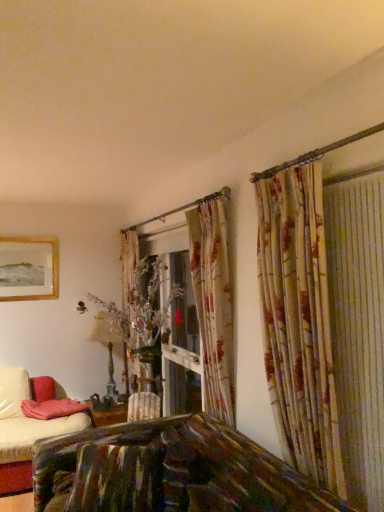
Question: Does antique brass table lamp at center contain pink fabric pillow at lower left?

Choices:
 (A) no
 (B) yes

Answer: (A)

Question: Can you confirm if antique brass table lamp at center is wider than pink fabric pillow at lower left?

Choices:
 (A) yes
 (B) no

Answer: (B)

Question: Considering the relative positions of antique brass table lamp at center and pink fabric pillow at lower left in the image provided, is antique brass table lamp at center in front of pink fabric pillow at lower left?

Choices:
 (A) no
 (B) yes

Answer: (A)

Question: Is antique brass table lamp at center taller than pink fabric pillow at lower left?

Choices:
 (A) no
 (B) yes

Answer: (B)

Question: Is antique brass table lamp at center bigger than pink fabric pillow at lower left?

Choices:
 (A) no
 (B) yes

Answer: (B)

Question: Does antique brass table lamp at center have a smaller size compared to pink fabric pillow at lower left?

Choices:
 (A) yes
 (B) no

Answer: (B)

Question: Does pink fabric pillow at lower left lie behind wooden framed picture at upper left?

Choices:
 (A) yes
 (B) no

Answer: (B)

Question: Is pink fabric pillow at lower left to the left of wooden framed picture at upper left from the viewer's perspective?

Choices:
 (A) no
 (B) yes

Answer: (A)

Question: From the image's perspective, is pink fabric pillow at lower left on wooden framed picture at upper left?

Choices:
 (A) yes
 (B) no

Answer: (B)

Question: Is pink fabric pillow at lower left outside wooden framed picture at upper left?

Choices:
 (A) no
 (B) yes

Answer: (B)

Question: Can you confirm if pink fabric pillow at lower left is smaller than wooden framed picture at upper left?

Choices:
 (A) no
 (B) yes

Answer: (A)

Question: Can you confirm if pink fabric pillow at lower left is shorter than wooden framed picture at upper left?

Choices:
 (A) yes
 (B) no

Answer: (A)

Question: Is wooden framed picture at upper left positioned in front of antique brass table lamp at center?

Choices:
 (A) no
 (B) yes

Answer: (A)